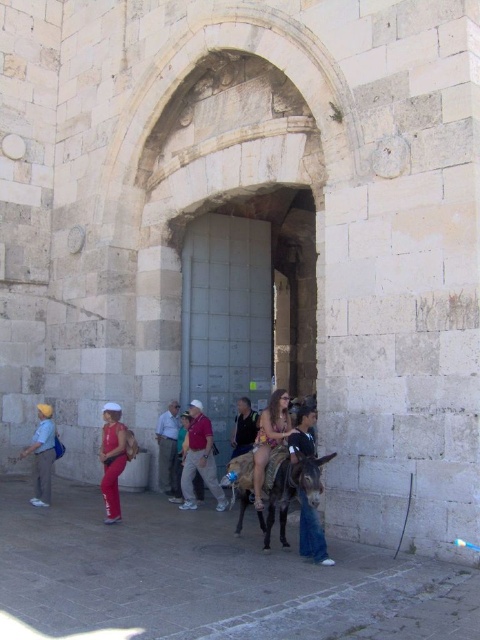
You are standing at the center of the archway and see the point marked at coordinates (111, 458). What object is located at that point?

The object at point (111, 458) is the matte pink pants at lower left.